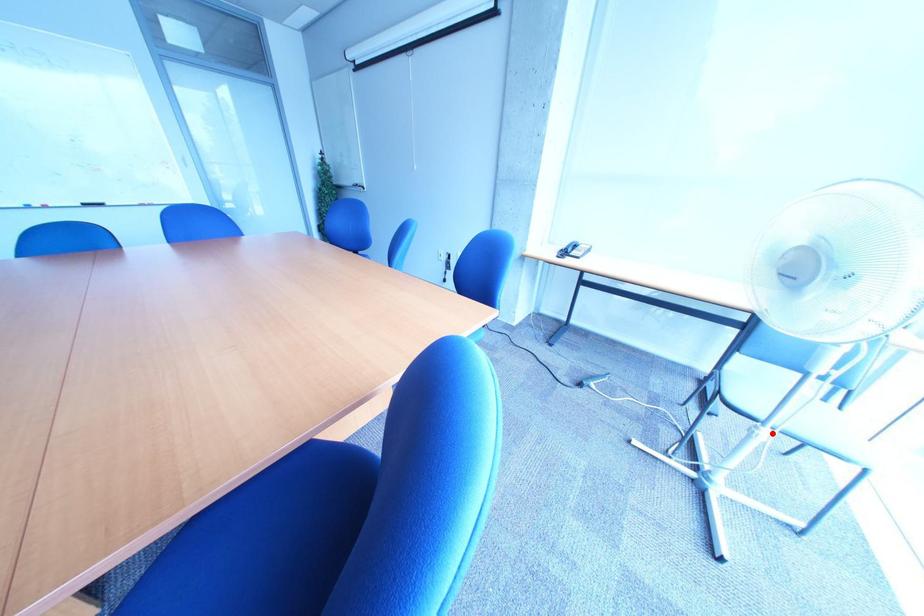
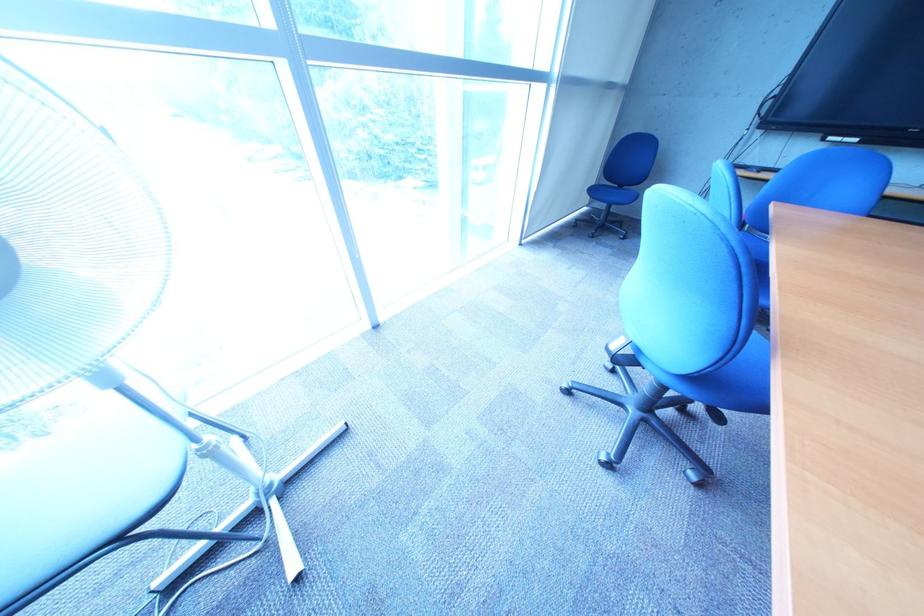
Question: I am providing you with two images of the same scene from different viewpoints. In image1, a red point is highlighted. Considering the same 3D point in image2, which of the following is correct?

Choices:
 (A) It is closer
 (B) It is farther

Answer: (A)